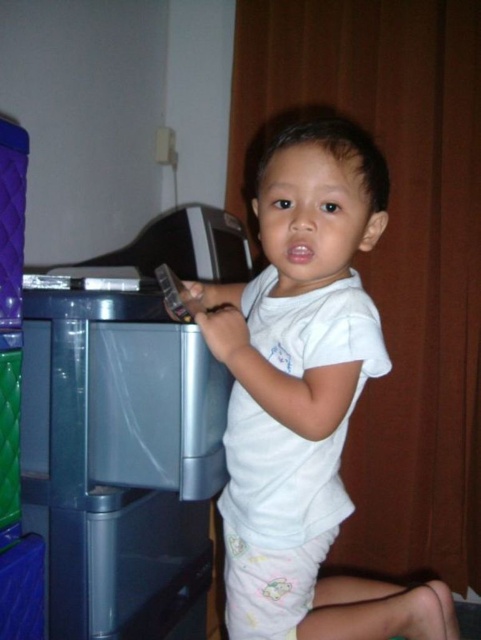
You are a fashion designer looking at the image. You need to decide which item is taller between the white cotton shirt at center and the transparent plastic atm at left. Which one is taller?

The white cotton shirt at center is taller than the transparent plastic atm at left.

You are a tailor measuring a customer for a custom shirt. The customer is wearing the white cotton shirt at center. If your measuring tape shows 31.12 inches between the shirt and the viewer, is this measurement within the standard 30 inch tolerance for shirt length? Please answer yes or no.

The white cotton shirt at center and viewer are 31.12 inches apart, which exceeds the standard 30 inch tolerance for shirt length. The answer is no.

You are a drone operator trying to navigate a small drone through a room. The drone must fly from point A to point B. Point A is at coordinates point (x=210, y=300) and point B is at coordinates point (x=167, y=604). According to the scene description, is there an obstacle between these two points that the drone needs to avoid?

Point (x=210, y=300) is behind point (x=167, y=604), so the drone would not encounter any obstacles between them as the first point is positioned behind the second one in the scene.